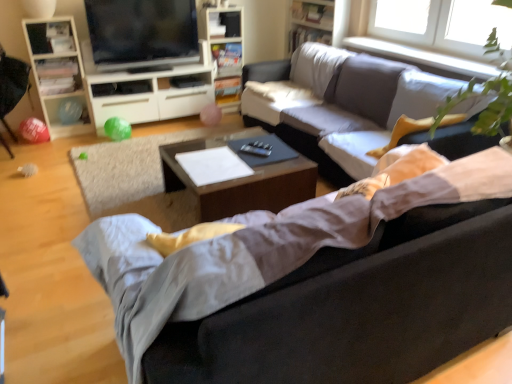
How much space does wooden bookshelf at upper center, marked as the 2th bookshelf in a right-to-left arrangement, occupy horizontally?

The width of wooden bookshelf at upper center, marked as the 2th bookshelf in a right-to-left arrangement, is 12.39 inches.

The height and width of the screenshot is (384, 512). Describe the element at coordinates (313, 23) in the screenshot. I see `wooden bookshelf at upper center, the second bookshelf viewed from the left` at that location.

The image size is (512, 384). What are the coordinates of `wooden bookshelf at upper center, the second bookshelf viewed from the left` in the screenshot? It's located at (313, 23).

You are a GUI agent. You are given a task and a screenshot of the screen. Output one action in this format:
    pyautogui.click(x=<x>, y=<y>)
    Task: Click on the dark gray fabric couch at center, the 1th studio couch from the front
    The height and width of the screenshot is (384, 512).
    Given the screenshot: What is the action you would take?
    pyautogui.click(x=256, y=249)

Describe the element at coordinates (353, 108) in the screenshot. I see `soft gray fabric couch at center, the second studio couch in the front-to-back sequence` at that location.

How much space does soft gray fabric couch at center, the second studio couch in the front-to-back sequence, occupy vertically?

30.57 inches.

Identify the location of matte white cabinet at center left. (150, 94).

This screenshot has width=512, height=384. In order to click on wooden bookshelf at upper center, marked as the 2th bookshelf in a right-to-left arrangement in this screenshot , I will do `click(223, 50)`.

Who is smaller, matte black tv at upper left or transparent glass window at upper right?

With smaller size is transparent glass window at upper right.

Which is correct: matte black tv at upper left is inside transparent glass window at upper right, or outside of it?

matte black tv at upper left lies outside transparent glass window at upper right.

Can you confirm if matte black tv at upper left is positioned to the right of transparent glass window at upper right?

No.

Can you confirm if matte black tv at upper left is shorter than transparent glass window at upper right?

No.

From a real-world perspective, which object stands above the other?

white wood cabinet at left, from a real-world perspective.

How many degrees apart are the facing directions of woodenwoodencoffee table at center and white wood cabinet at left?

179 degrees.

Does woodenwoodencoffee table at center have a greater width compared to white wood cabinet at left?

Indeed, woodenwoodencoffee table at center has a greater width compared to white wood cabinet at left.

Who is shorter, woodenwoodencoffee table at center or white wood cabinet at left?

woodenwoodencoffee table at center is shorter.

Does woodenwoodencoffee table at center come in front of matte white cabinet at center left?

Yes, woodenwoodencoffee table at center is closer to the viewer.

Can we say woodenwoodencoffee table at center lies outside matte white cabinet at center left?

Yes, woodenwoodencoffee table at center is located beyond the bounds of matte white cabinet at center left.

From the image's perspective, is woodenwoodencoffee table at center above matte white cabinet at center left?

Actually, woodenwoodencoffee table at center appears below matte white cabinet at center left in the image.

The width and height of the screenshot is (512, 384). Find the location of `coffee table that appears below the matte white cabinet at center left (from a real-world perspective)`. coffee table that appears below the matte white cabinet at center left (from a real-world perspective) is located at coordinates (241, 183).

From the image's perspective, is wooden bookshelf at upper center, placed as the 1th bookshelf when sorted from right to left, located above or below transparent glass window at upper right?

wooden bookshelf at upper center, placed as the 1th bookshelf when sorted from right to left, is above transparent glass window at upper right.

From the transparent glass window at upper right, count 1st bookshelfs backward and point to it. Please provide its 2D coordinates.

[(313, 23)]

From a real-world perspective, is wooden bookshelf at upper center, placed as the 1th bookshelf when sorted from right to left, positioned under transparent glass window at upper right based on gravity?

Incorrect, from a real-world perspective, wooden bookshelf at upper center, placed as the 1th bookshelf when sorted from right to left, is higher than transparent glass window at upper right.

Is point (325, 10) behind point (417, 31)?

Yes, it is.

Does matte black armchair at left lie in front of wooden bookshelf at upper center, the second bookshelf viewed from the left?

Yes, matte black armchair at left is closer to the camera.

Does matte black armchair at left appear on the left side of wooden bookshelf at upper center, placed as the 1th bookshelf when sorted from right to left?

Yes.

Considering the sizes of objects matte black armchair at left and wooden bookshelf at upper center, the second bookshelf viewed from the left, in the image provided, who is thinner, matte black armchair at left or wooden bookshelf at upper center, the second bookshelf viewed from the left,?

With smaller width is wooden bookshelf at upper center, the second bookshelf viewed from the left.

Where is `armchair in front of the wooden bookshelf at upper center, the second bookshelf viewed from the left`? This screenshot has width=512, height=384. armchair in front of the wooden bookshelf at upper center, the second bookshelf viewed from the left is located at coordinates (12, 85).

Does point (8, 92) appear closer or farther from the camera than point (41, 43)?

Point (8, 92).

Which object is positioned more to the left, matte black armchair at left or white wood cabinet at left?

From the viewer's perspective, matte black armchair at left appears more on the left side.

Who is taller, matte black armchair at left or white wood cabinet at left?

white wood cabinet at left is taller.

In the scene shown: Does matte black armchair at left touch white wood cabinet at left?

matte black armchair at left and white wood cabinet at left are clearly separated.

From a real-world perspective, is transparent glass window at upper right on top of matte black tv at upper left?

No.

Are transparent glass window at upper right and matte black tv at upper left far apart?

Indeed, transparent glass window at upper right is not near matte black tv at upper left.

What's the angular difference between transparent glass window at upper right and matte black tv at upper left's facing directions?

transparent glass window at upper right and matte black tv at upper left are facing 88.4 degrees away from each other.

Is transparent glass window at upper right smaller than matte black tv at upper left?

Indeed, transparent glass window at upper right has a smaller size compared to matte black tv at upper left.

Find the location of a particular element. The image size is (512, 384). television above the transparent glass window at upper right (from the image's perspective) is located at coordinates (142, 33).

At what (x,y) coordinates should I click in order to perform the action: click on cabinetry lying behind the woodenwoodencoffee table at center. Please return your answer as a coordinate pair (x, y). Looking at the image, I should click on (57, 72).

Looking at the image, which one is located further to wooden bookshelf at upper center, marked as the 2th bookshelf in a right-to-left arrangement, transparent glass window at upper right or white wood cabinet at left?

transparent glass window at upper right lies further to wooden bookshelf at upper center, marked as the 2th bookshelf in a right-to-left arrangement, than the other object.

Estimate the real-world distances between objects in this image. Which object is closer to matte white cabinet at center left, transparent glass window at upper right or white wood cabinet at left?

Among the two, white wood cabinet at left is located nearer to matte white cabinet at center left.

Based on the photo, which object lies nearer to the anchor point wooden bookshelf at upper center, marked as the 2th bookshelf in a right-to-left arrangement, soft gray fabric couch at center, the second studio couch in the front-to-back sequence, or white matte sheet at center?

soft gray fabric couch at center, the second studio couch in the front-to-back sequence.

Based on their spatial positions, is dark gray fabric couch at center, which is counted as the second studio couch, starting from the back, or matte black armchair at left further from woodenwoodencoffee table at center?

matte black armchair at left is further to woodenwoodencoffee table at center.

Based on their spatial positions, is matte black tv at upper left or matte white cabinet at center left closer to wooden bookshelf at upper center, acting as the 1th bookshelf starting from the left?

Based on the image, matte black tv at upper left appears to be nearer to wooden bookshelf at upper center, acting as the 1th bookshelf starting from the left.

From the image, which object appears to be nearer to dark gray fabric couch at center, which is counted as the second studio couch, starting from the back, wooden bookshelf at upper center, marked as the 2th bookshelf in a right-to-left arrangement, or white matte sheet at center?

Based on the image, white matte sheet at center appears to be nearer to dark gray fabric couch at center, which is counted as the second studio couch, starting from the back.

From the image, which object appears to be farther from matte black tv at upper left, wooden bookshelf at upper center, acting as the 1th bookshelf starting from the left, or soft gray fabric couch at center, the second studio couch in the front-to-back sequence?

soft gray fabric couch at center, the second studio couch in the front-to-back sequence, lies further to matte black tv at upper left than the other object.

Based on their spatial positions, is white matte sheet at center or wooden bookshelf at upper center, marked as the 2th bookshelf in a right-to-left arrangement, closer to woodenwoodencoffee table at center?

white matte sheet at center is positioned closer to the anchor woodenwoodencoffee table at center.

Where is `studio couch located between dark gray fabric couch at center, the 1th studio couch from the front, and wooden bookshelf at upper center, acting as the 1th bookshelf starting from the left, in the depth direction`? This screenshot has width=512, height=384. studio couch located between dark gray fabric couch at center, the 1th studio couch from the front, and wooden bookshelf at upper center, acting as the 1th bookshelf starting from the left, in the depth direction is located at coordinates (353, 108).

Locate an element on the screen. television between matte black armchair at left and soft gray fabric couch at center, the second studio couch in the front-to-back sequence, in the horizontal direction is located at coordinates (142, 33).

Where is `window between soft gray fabric couch at center, arranged as the 1th studio couch when viewed from the back, and wooden bookshelf at upper center, placed as the 1th bookshelf when sorted from right to left, along the z-axis`? This screenshot has height=384, width=512. window between soft gray fabric couch at center, arranged as the 1th studio couch when viewed from the back, and wooden bookshelf at upper center, placed as the 1th bookshelf when sorted from right to left, along the z-axis is located at coordinates (434, 33).

Locate an element on the screen. The height and width of the screenshot is (384, 512). window positioned between soft gray fabric couch at center, arranged as the 1th studio couch when viewed from the back, and wooden bookshelf at upper center, acting as the 1th bookshelf starting from the left, from near to far is located at coordinates (434, 33).